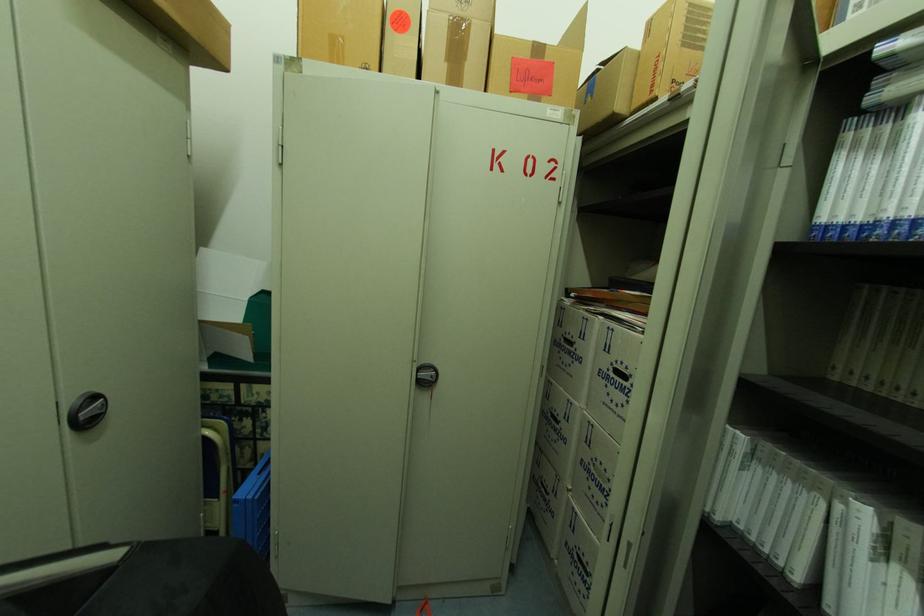
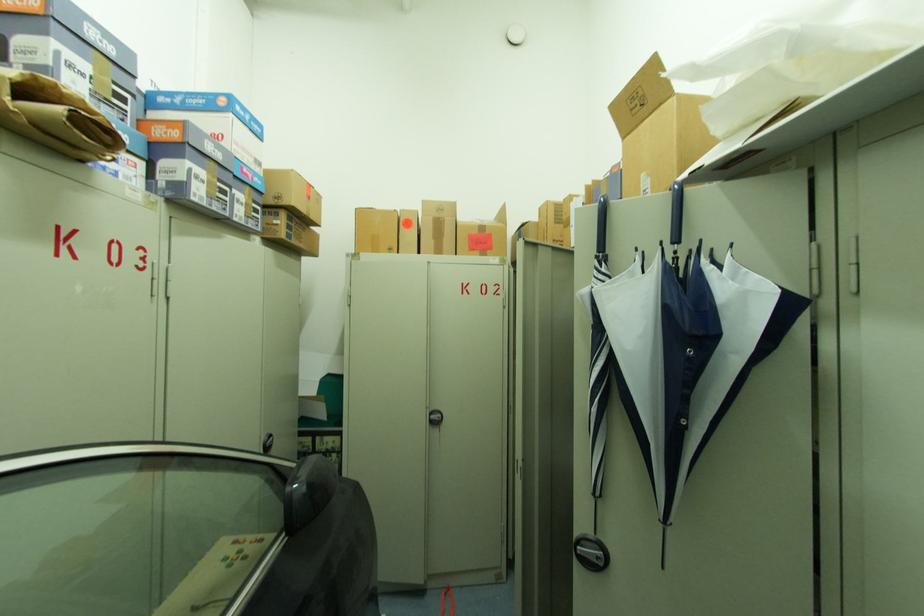
Question: How did the camera likely rotate?

Choices:
 (A) Left
 (B) Right
 (C) Up
 (D) Down

Answer: (C)